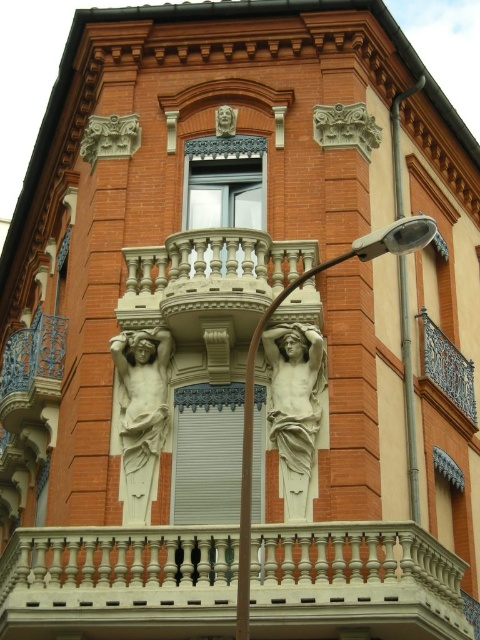
You are standing at the point marked at coordinates point [304,433]. You want to walk to the nearest balcony. Which direction should you go?

The nearest balcony is located to the north of point [304,433]. You should walk north to reach it.

You are standing in front of the building and want to locate the white marble balustrade at center. What are the coordinates where you should look?

The white marble balustrade at center is located at coordinates point (119,582).